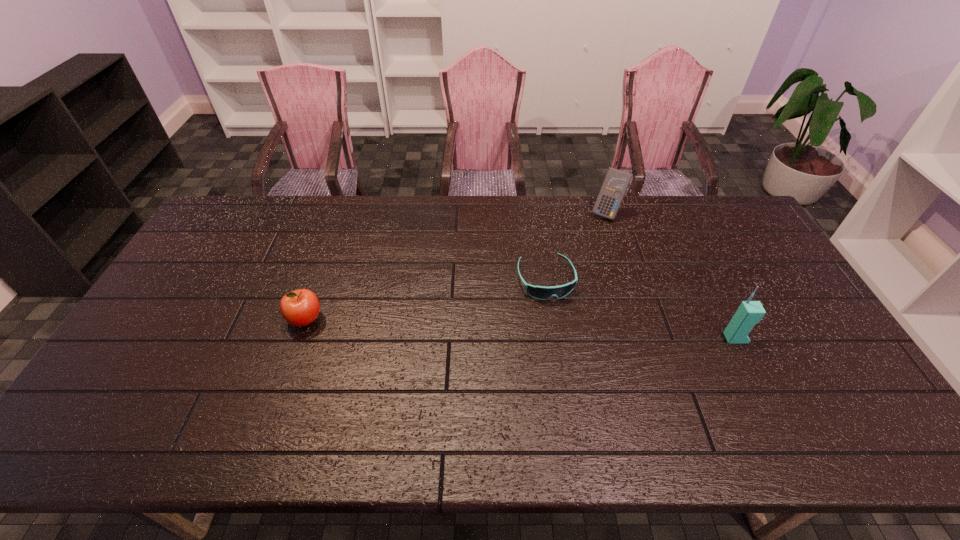
Where is `apple`? This screenshot has width=960, height=540. apple is located at coordinates (301, 307).

Locate an element on the screen. This screenshot has width=960, height=540. the second shortest object is located at coordinates (301, 307).

At what (x,y) coordinates should I click in order to perform the action: click on the rightmost object. Please return your answer as a coordinate pair (x, y). Looking at the image, I should click on (749, 313).

Locate an element on the screen. This screenshot has width=960, height=540. the third nearest object is located at coordinates (539, 292).

Find the location of a particular element. The height and width of the screenshot is (540, 960). sunglasses is located at coordinates (539, 292).

Where is `the third object from left to right`? The image size is (960, 540). the third object from left to right is located at coordinates (616, 182).

Locate an element on the screen. This screenshot has height=540, width=960. calculator is located at coordinates (616, 182).

Identify the location of vacant space located on the front of the leftmost object. (286, 375).

The image size is (960, 540). Find the location of `free space located 0.160m on the keypad of the rightmost object`. free space located 0.160m on the keypad of the rightmost object is located at coordinates (804, 338).

The image size is (960, 540). Identify the location of vacant space located 0.320m on the front-facing side of the second farthest object. (586, 400).